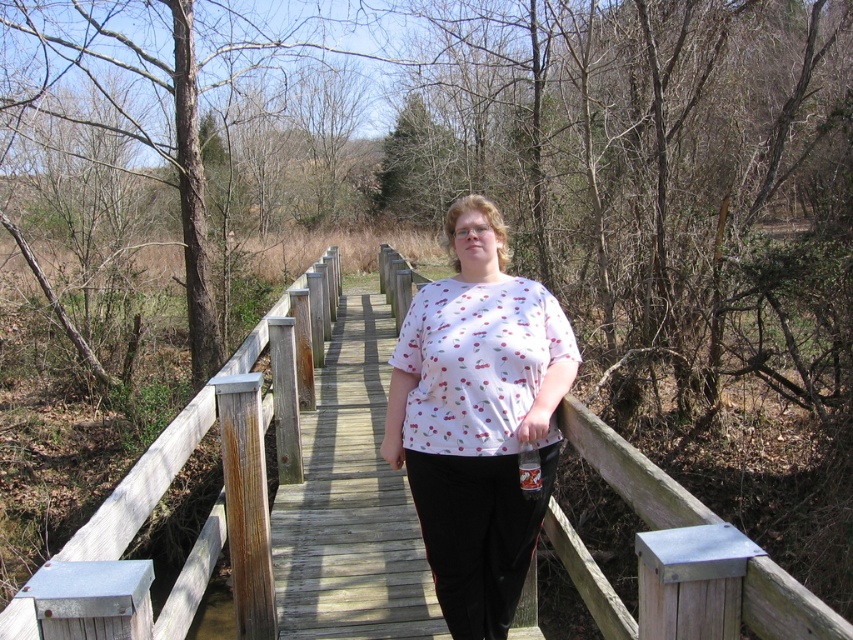
You are a hiker who wants to cross the wooden bridge at center and the wooden fence at center. Which structure is wider?

The wooden bridge at center is wider than the wooden fence at center because the wooden bridge at center has a greater width as per the description.

You are a photographer trying to capture the scene of the person on the boardwalk. You want to ensure the white printed shirt at center and the wooden fence at center are both visible in your shot. Based on their positions, which object should appear lower in the photo?

The white printed shirt at center is located below the wooden fence at center, so in the photo, the white printed shirt at center will appear lower than the wooden fence at center.